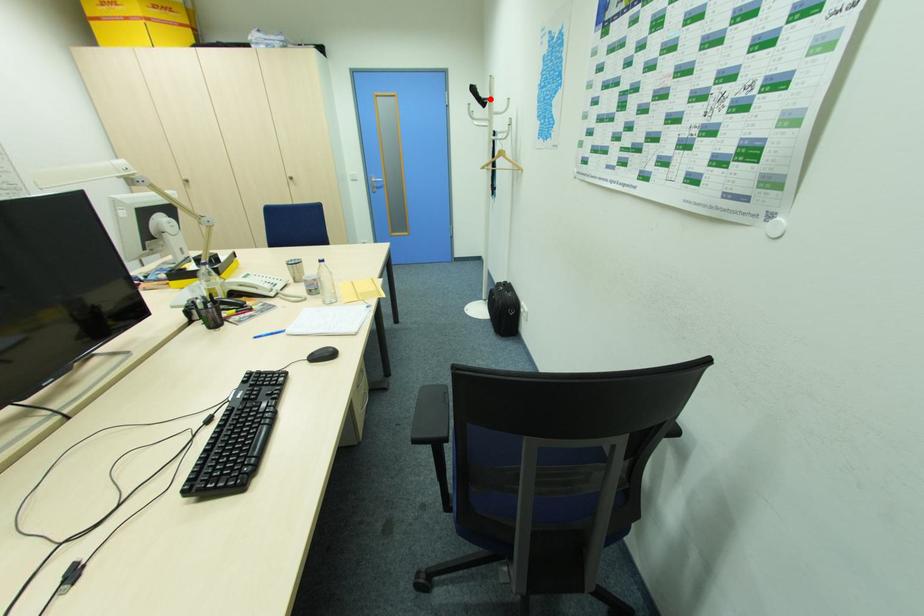
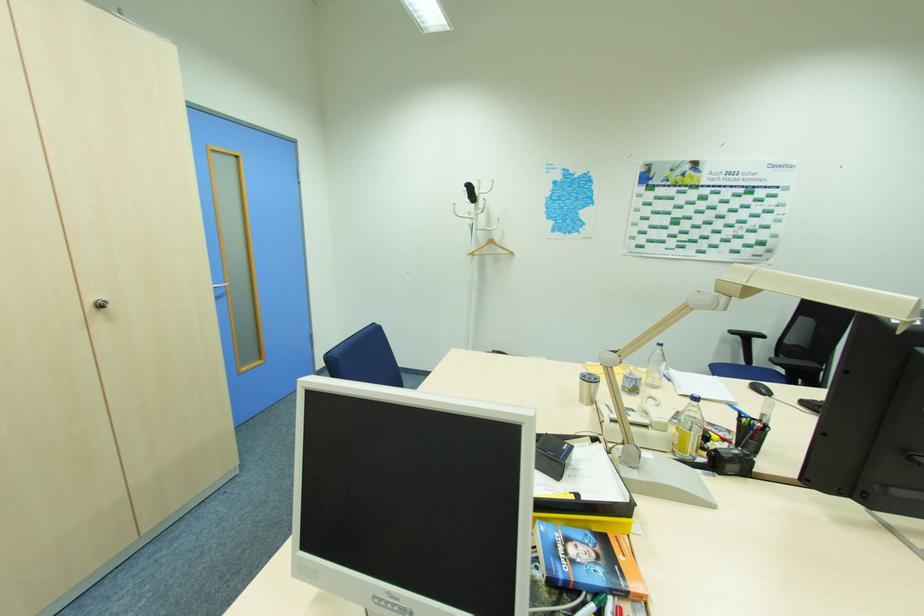
Locate, in the second image, the point that corresponds to the highlighted location in the first image.

(479, 197)